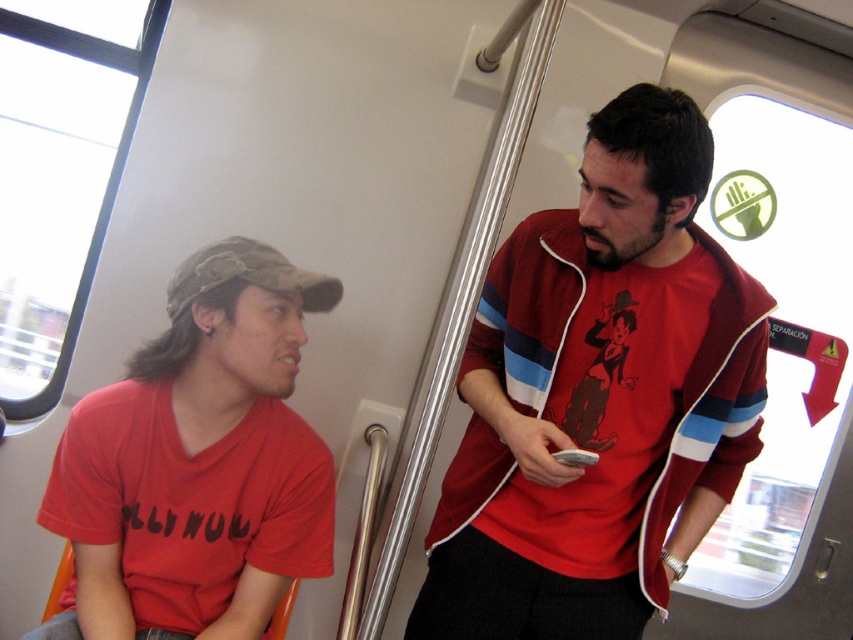
Is point (198, 291) positioned after point (207, 336)?

Yes, it is.

Which is more to the left, camouflage fabric baseball cap at left or black matte earphone at left?

From the viewer's perspective, black matte earphone at left appears more on the left side.

Which is behind, point (250, 244) or point (213, 326)?

The point (250, 244) is behind.

The image size is (853, 640). I want to click on camouflage fabric baseball cap at left, so pyautogui.click(x=247, y=275).

Between matte red t-shirt at center and camouflage fabric baseball cap at left, which one appears on the right side from the viewer's perspective?

matte red t-shirt at center is more to the right.

Based on the photo, which is more to the left, matte red t-shirt at center or camouflage fabric baseball cap at left?

camouflage fabric baseball cap at left

Which is behind, point (756, 454) or point (183, 273)?

Point (183, 273)

In order to click on matte red t-shirt at center in this screenshot , I will do `click(598, 396)`.

Can you confirm if matte red t-shirt at center is thinner than black matte earphone at left?

No, matte red t-shirt at center is not thinner than black matte earphone at left.

Which is more to the right, matte red t-shirt at center or black matte earphone at left?

matte red t-shirt at center is more to the right.

What do you see at coordinates (598, 396) in the screenshot?
I see `matte red t-shirt at center` at bounding box center [598, 396].

This screenshot has width=853, height=640. In order to click on matte red t-shirt at center in this screenshot , I will do `click(598, 396)`.